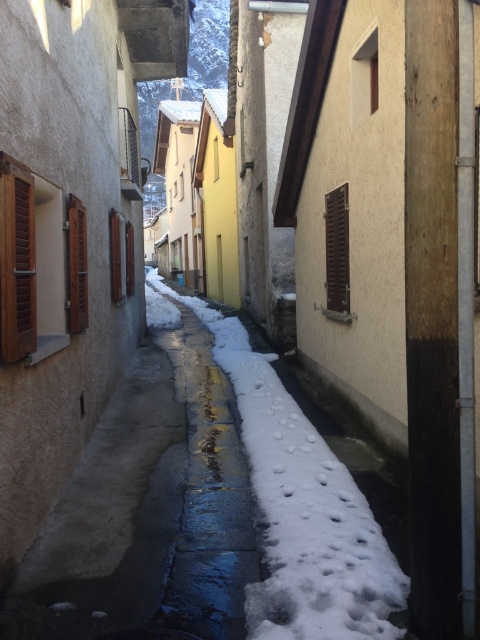
You are standing at the entrance of the alley and want to walk to the end. There is white fluffy snow at center in your path. Where is the snow located relative to your starting position?

The white fluffy snow at center is located at point 0.797 meters to the right and 0.629 meters forward from your starting position.

You are a painter standing in the middle of the alleyway. You want to paint both the brown wooden shutters at right and the wooden at left. Which object should you paint first if you want to start with the larger one?

You should start with the brown wooden shutters at right because it is bigger than the wooden at left.